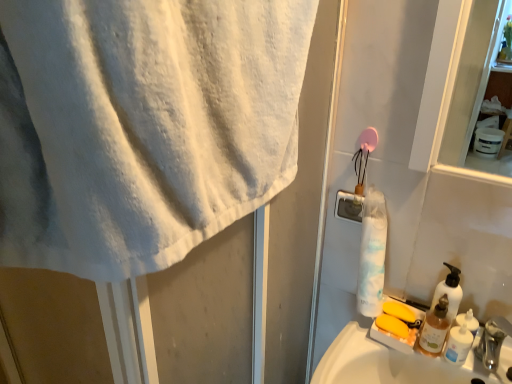
Question: Are white matte shaving cream at lower right and white cotton towel at upper left beside each other?

Choices:
 (A) no
 (B) yes

Answer: (A)

Question: Can you confirm if white matte shaving cream at lower right is taller than white cotton towel at upper left?

Choices:
 (A) yes
 (B) no

Answer: (B)

Question: Does white matte shaving cream at lower right have a greater width compared to white cotton towel at upper left?

Choices:
 (A) yes
 (B) no

Answer: (B)

Question: From a real-world perspective, is white matte shaving cream at lower right below white cotton towel at upper left?

Choices:
 (A) yes
 (B) no

Answer: (A)

Question: Is white matte shaving cream at lower right shorter than white cotton towel at upper left?

Choices:
 (A) no
 (B) yes

Answer: (B)

Question: Is the position of white matte shaving cream at lower right more distant than that of white cotton towel at upper left?

Choices:
 (A) yes
 (B) no

Answer: (A)

Question: Is white matte shaving cream at lower right shorter than silver metallic faucet at lower right?

Choices:
 (A) no
 (B) yes

Answer: (B)

Question: Does white matte shaving cream at lower right turn towards silver metallic faucet at lower right?

Choices:
 (A) yes
 (B) no

Answer: (B)

Question: Does white matte shaving cream at lower right have a lesser width compared to silver metallic faucet at lower right?

Choices:
 (A) yes
 (B) no

Answer: (A)

Question: From a real-world perspective, is white matte shaving cream at lower right under silver metallic faucet at lower right?

Choices:
 (A) no
 (B) yes

Answer: (B)

Question: Can you confirm if white matte shaving cream at lower right is wider than silver metallic faucet at lower right?

Choices:
 (A) no
 (B) yes

Answer: (A)

Question: From the image's perspective, is white matte shaving cream at lower right over silver metallic faucet at lower right?

Choices:
 (A) yes
 (B) no

Answer: (A)

Question: Is white matte shaving cream at lower right positioned far away from white matte soap dispenser at right?

Choices:
 (A) yes
 (B) no

Answer: (B)